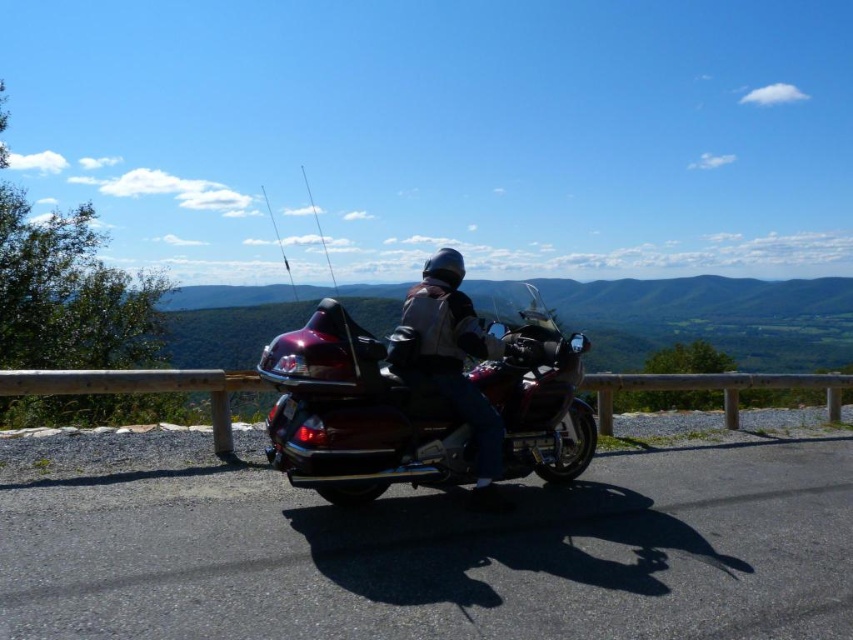
You are a hiker who wants to take a photo of the metallic silver fishing pole at upper center and the metallic fishing pole at upper center. Which one should you focus on first to ensure both are in the frame without moving the camera?

You should focus on the metallic silver fishing pole at upper center first because it is in front of the metallic fishing pole at upper center, allowing both to be captured in the same frame without moving the camera.